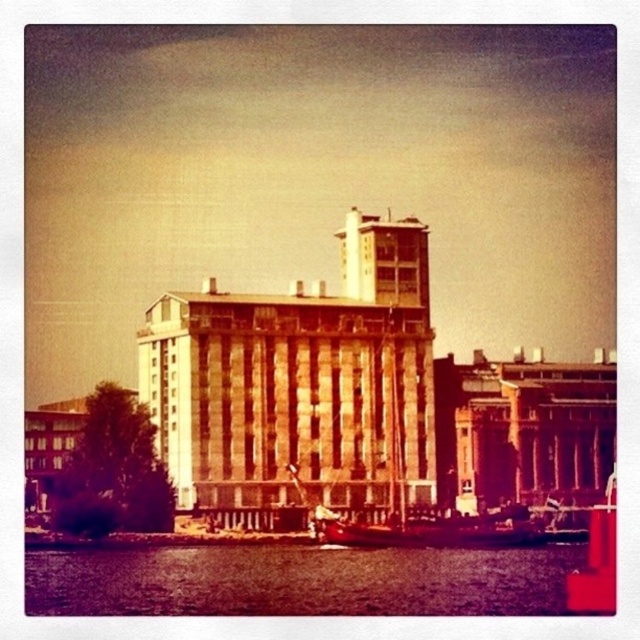
Question: Considering the relative positions of purple water at lower left and smooth wooden boat at center in the image provided, where is purple water at lower left located with respect to smooth wooden boat at center?

Choices:
 (A) below
 (B) above

Answer: (A)

Question: Among these objects, which one is farthest from the camera?

Choices:
 (A) purple water at lower left
 (B) smooth wooden boat at center

Answer: (B)

Question: Is the position of purple water at lower left less distant than that of smooth wooden boat at center?

Choices:
 (A) no
 (B) yes

Answer: (B)

Question: Does purple water at lower left appear over smooth wooden boat at center?

Choices:
 (A) no
 (B) yes

Answer: (A)

Question: Which object is farther from the camera taking this photo?

Choices:
 (A) purple water at lower left
 (B) smooth wooden boat at center

Answer: (B)